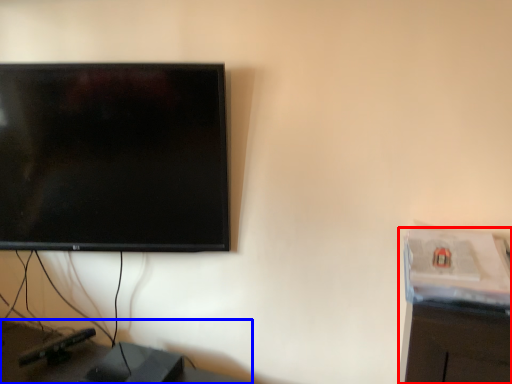
Question: Which object is further to the camera taking this photo, computer desk (highlighted by a red box) or furniture (highlighted by a blue box)?

Choices:
 (A) computer desk
 (B) furniture

Answer: (B)